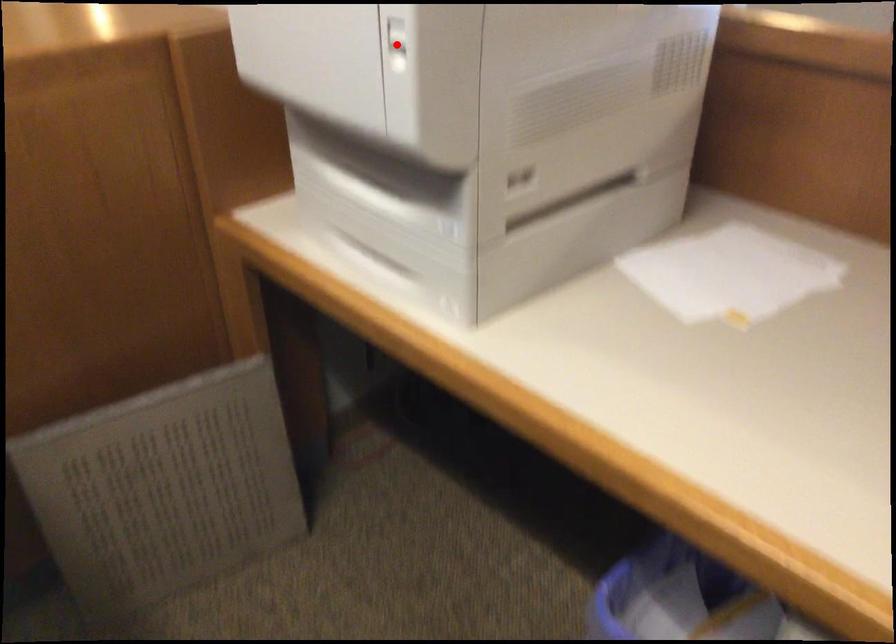
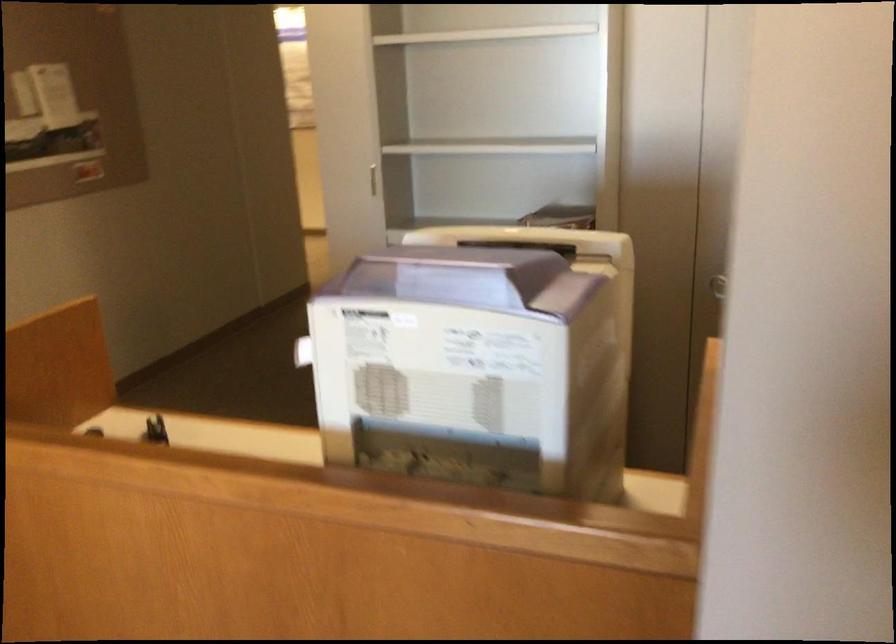
Question: I am providing you with two images of the same scene from different viewpoints. A red point is marked on the first image. Can you still see the location of the red point in image 2?

Choices:
 (A) Yes
 (B) No

Answer: (B)